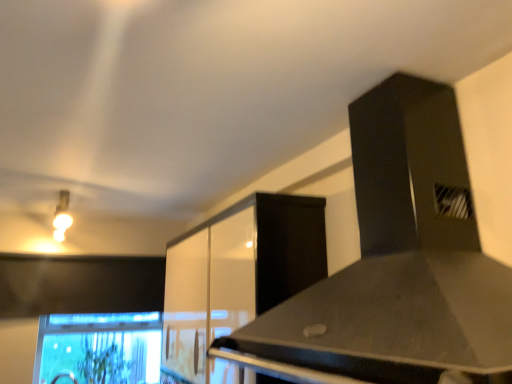
Question: From the image's perspective, is matte gold light fixture at upper left positioned above or below green leafy plant at lower left?

Choices:
 (A) above
 (B) below

Answer: (A)

Question: In the image, is matte gold light fixture at upper left on the left side or the right side of green leafy plant at lower left?

Choices:
 (A) right
 (B) left

Answer: (B)

Question: Considering the real-world distances, which object is farthest from the green leafy plant at lower left?

Choices:
 (A) matte gold light fixture at upper left
 (B) black matte vent at upper right
 (C) clear glass monitor at lower left
 (D) glossy white cabinet at center

Answer: (B)

Question: Which of these objects is positioned farthest from the black matte vent at upper right?

Choices:
 (A) matte gold light fixture at upper left
 (B) glossy white cabinet at center
 (C) green leafy plant at lower left
 (D) clear glass monitor at lower left

Answer: (C)